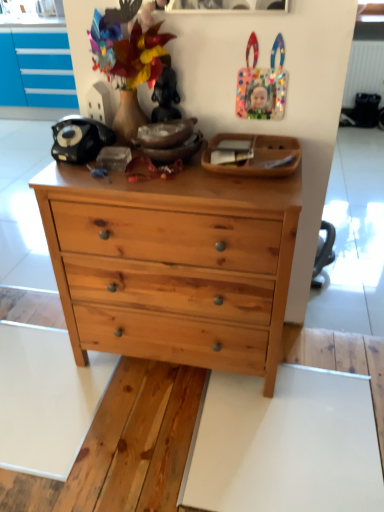
Question: Is wooden tray at upper center outside natural wood chest of drawers at center?

Choices:
 (A) no
 (B) yes

Answer: (B)

Question: Is wooden tray at upper center facing towards natural wood chest of drawers at center?

Choices:
 (A) no
 (B) yes

Answer: (A)

Question: Can you confirm if wooden tray at upper center is wider than natural wood chest of drawers at center?

Choices:
 (A) yes
 (B) no

Answer: (B)

Question: Is wooden tray at upper center bigger than natural wood chest of drawers at center?

Choices:
 (A) no
 (B) yes

Answer: (A)

Question: Is wooden tray at upper center oriented away from natural wood chest of drawers at center?

Choices:
 (A) yes
 (B) no

Answer: (B)

Question: From a real-world perspective, is wooden tray at upper center physically below natural wood chest of drawers at center?

Choices:
 (A) yes
 (B) no

Answer: (B)

Question: Considering the relative sizes of natural wood chest of drawers at center and wooden tray at upper center in the image provided, is natural wood chest of drawers at center thinner than wooden tray at upper center?

Choices:
 (A) no
 (B) yes

Answer: (A)

Question: From the image's perspective, would you say natural wood chest of drawers at center is positioned over wooden tray at upper center?

Choices:
 (A) no
 (B) yes

Answer: (A)

Question: Considering the relative sizes of natural wood chest of drawers at center and wooden tray at upper center in the image provided, is natural wood chest of drawers at center taller than wooden tray at upper center?

Choices:
 (A) no
 (B) yes

Answer: (B)

Question: Considering the relative sizes of natural wood chest of drawers at center and wooden tray at upper center in the image provided, is natural wood chest of drawers at center smaller than wooden tray at upper center?

Choices:
 (A) yes
 (B) no

Answer: (B)

Question: Is natural wood chest of drawers at center not near wooden tray at upper center?

Choices:
 (A) no
 (B) yes

Answer: (A)

Question: Is natural wood chest of drawers at center surrounding wooden tray at upper center?

Choices:
 (A) no
 (B) yes

Answer: (A)

Question: From a real-world perspective, is wooden tray at upper center positioned above or below natural wood chest of drawers at center?

Choices:
 (A) below
 (B) above

Answer: (B)